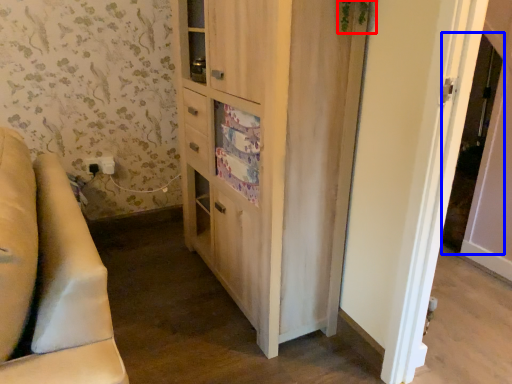
Question: Which object appears farthest to the camera in this image, plant (highlighted by a red box) or screen door (highlighted by a blue box)?

Choices:
 (A) plant
 (B) screen door

Answer: (B)